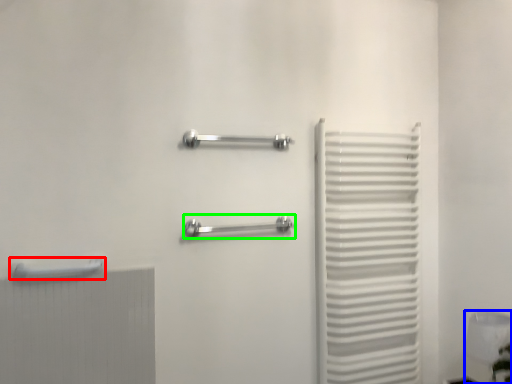
Question: Which is farther away from towel rack (highlighted by a red box)? lamp (highlighted by a blue box) or towel rack (highlighted by a green box)?

Choices:
 (A) lamp
 (B) towel rack

Answer: (A)